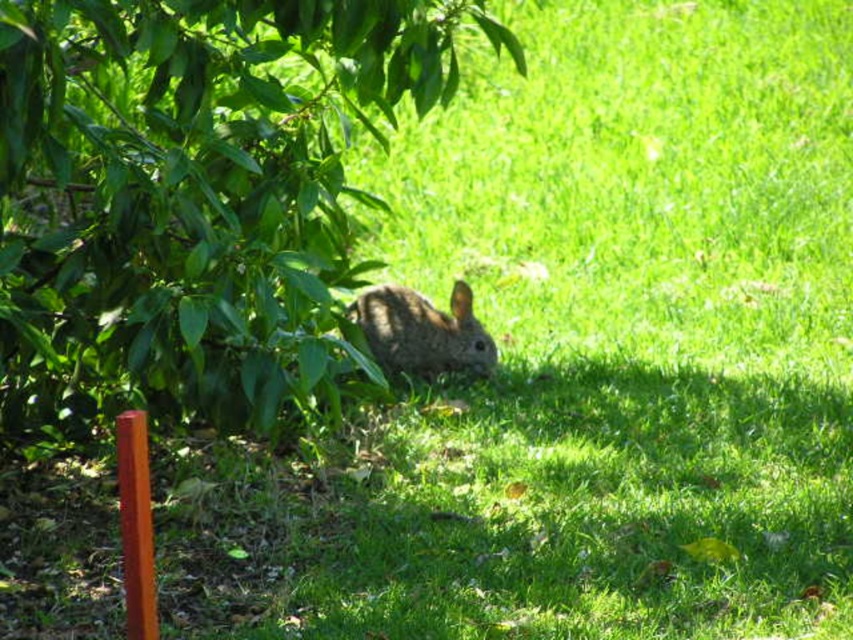
In the scene shown: Based on the scene description, which object is taller between the green leafy tree at center and the fuzzy brown rabbit at center?

The green leafy tree at center is taller than the fuzzy brown rabbit at center according to the description.

You are a photographer trying to capture the fuzzy brown rabbit at center without the green leafy tree at center blocking the view. Can you adjust your position to do so?

The green leafy tree at center is positioned over the fuzzy brown rabbit at center, so adjusting your position to avoid the tree blocking the view might be challenging. You may need to move to a lower angle or position where the tree is not directly above the rabbit.

Based on the scene description, can you determine which object is bigger between the green leafy tree at center and the fuzzy brown rabbit at center?

The green leafy tree at center is larger in size than the fuzzy brown rabbit at center.